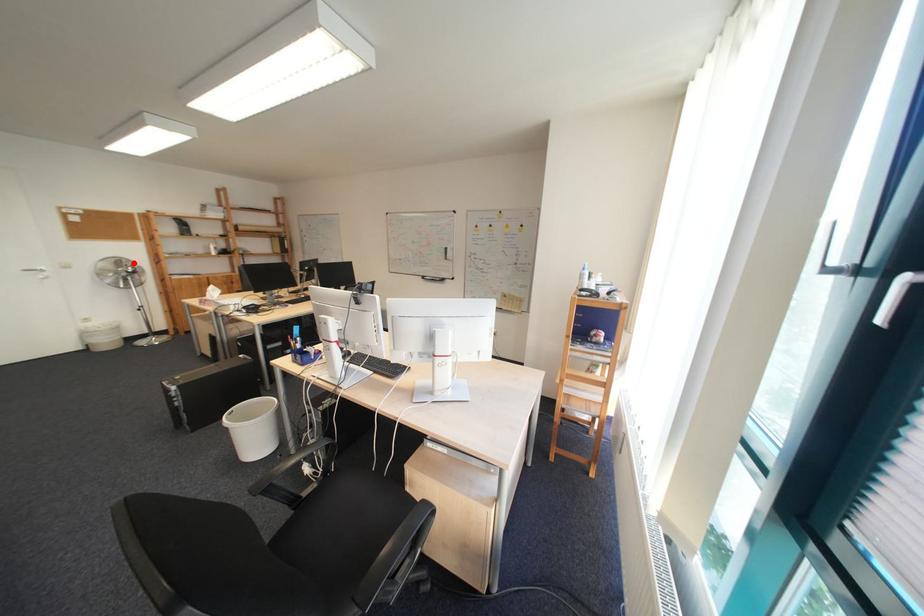
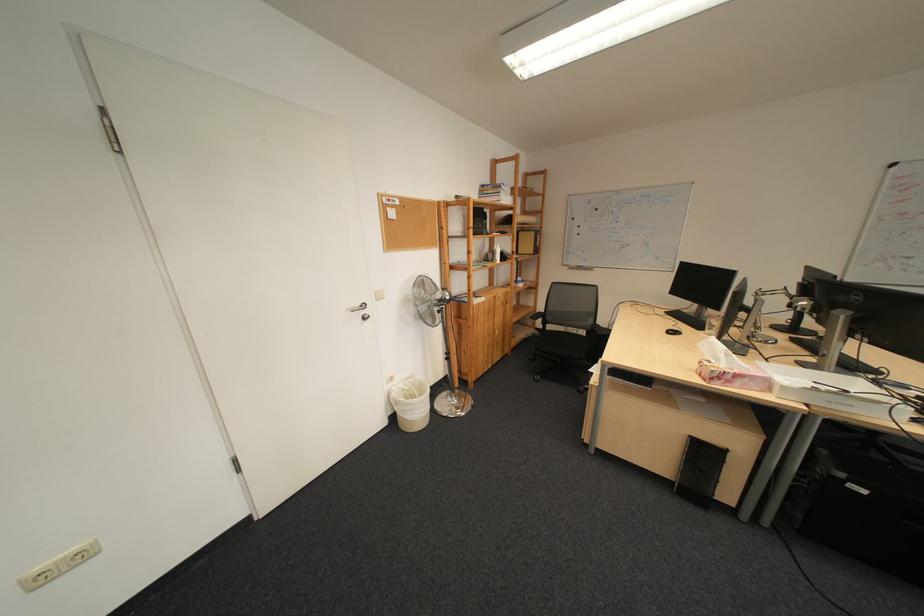
Locate, in the second image, the point that corresponds to the highlighted location in the first image.

(435, 284)